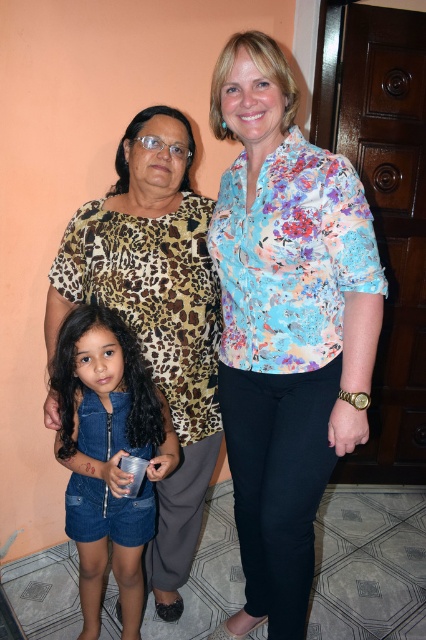
Question: Which of the following is the farthest from the observer?

Choices:
 (A) (317, 372)
 (B) (85, 208)

Answer: (B)

Question: Observing the image, what is the correct spatial positioning of floral print blouse at center in reference to leopard print blouse at center?

Choices:
 (A) right
 (B) left

Answer: (A)

Question: Which object is the closest to the denim romper at lower left?

Choices:
 (A) floral print blouse at center
 (B) leopard print blouse at center

Answer: (B)

Question: Does floral print blouse at center have a larger size compared to denim romper at lower left?

Choices:
 (A) yes
 (B) no

Answer: (A)

Question: Is leopard print blouse at center positioned before denim romper at lower left?

Choices:
 (A) yes
 (B) no

Answer: (B)

Question: Considering the real-world distances, which object is farthest from the floral print blouse at center?

Choices:
 (A) denim romper at lower left
 (B) leopard print blouse at center

Answer: (A)